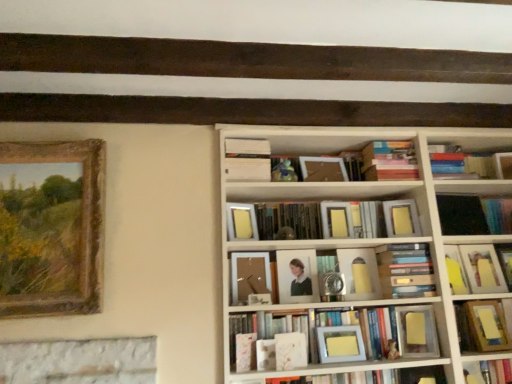
Question: From a real-world perspective, is gold-framed painting at left, which is the 4th picture frame from right to left, located beneath matte white frame at center, which is the 8th book in top-to-bottom order?

Choices:
 (A) yes
 (B) no

Answer: (B)

Question: Can you confirm if gold-framed painting at left, placed as the first picture frame when sorted from left to right, is positioned to the left of matte white frame at center, placed as the third book when sorted from bottom to top?

Choices:
 (A) yes
 (B) no

Answer: (A)

Question: Is gold-framed painting at left, placed as the first picture frame when sorted from left to right, oriented towards matte white frame at center, placed as the third book when sorted from bottom to top?

Choices:
 (A) yes
 (B) no

Answer: (B)

Question: Considering the relative sizes of gold-framed painting at left, placed as the first picture frame when sorted from left to right, and matte white frame at center, which is the 8th book in top-to-bottom order, in the image provided, is gold-framed painting at left, placed as the first picture frame when sorted from left to right, shorter than matte white frame at center, which is the 8th book in top-to-bottom order,?

Choices:
 (A) yes
 (B) no

Answer: (B)

Question: From a real-world perspective, is gold-framed painting at left, which is the 4th picture frame from right to left, on matte white frame at center, placed as the third book when sorted from bottom to top?

Choices:
 (A) no
 (B) yes

Answer: (B)

Question: From the image's perspective, relative to matte white frame at center, which is the 8th book in top-to-bottom order, is matte wooden picture frame at center, the 2th picture frame when ordered from left to right, above or below?

Choices:
 (A) above
 (B) below

Answer: (A)

Question: Is matte wooden picture frame at center, the 2th picture frame when ordered from left to right, in front of or behind matte white frame at center, placed as the third book when sorted from bottom to top, in the image?

Choices:
 (A) front
 (B) behind

Answer: (B)

Question: Visually, is matte wooden picture frame at center, the 2th picture frame when ordered from left to right, positioned to the left or to the right of matte white frame at center, placed as the third book when sorted from bottom to top?

Choices:
 (A) left
 (B) right

Answer: (A)

Question: Considering the positions of matte wooden picture frame at center, the 2th picture frame when ordered from left to right, and matte white frame at center, placed as the third book when sorted from bottom to top, in the image, is matte wooden picture frame at center, the 2th picture frame when ordered from left to right, wider or thinner than matte white frame at center, placed as the third book when sorted from bottom to top,?

Choices:
 (A) thin
 (B) wide

Answer: (A)

Question: Looking at their shapes, would you say matte yellow book at right, positioned as the fourth book in bottom-to-top order, is wider or thinner than matte white frame at center, placed as the third book when sorted from bottom to top?

Choices:
 (A) thin
 (B) wide

Answer: (A)

Question: Is matte yellow book at right, placed as the 7th book when sorted from top to bottom, taller or shorter than matte white frame at center, which is the 8th book in top-to-bottom order?

Choices:
 (A) tall
 (B) short

Answer: (A)

Question: Is matte yellow book at right, placed as the 7th book when sorted from top to bottom, spatially inside matte white frame at center, which is the 8th book in top-to-bottom order, or outside of it?

Choices:
 (A) inside
 (B) outside

Answer: (B)

Question: From a real-world perspective, is matte yellow book at right, placed as the 7th book when sorted from top to bottom, above or below matte white frame at center, placed as the third book when sorted from bottom to top?

Choices:
 (A) above
 (B) below

Answer: (A)

Question: In the image, is white matte book at center, which is counted as the ninth book, starting from the bottom, on the left side or the right side of matte yellow picture frame at center, the fourth picture frame when ordered from left to right?

Choices:
 (A) right
 (B) left

Answer: (B)

Question: From the image's perspective, is white matte book at center, which is counted as the ninth book, starting from the bottom, located above or below matte yellow picture frame at center, which is the first picture frame in right-to-left order?

Choices:
 (A) above
 (B) below

Answer: (A)